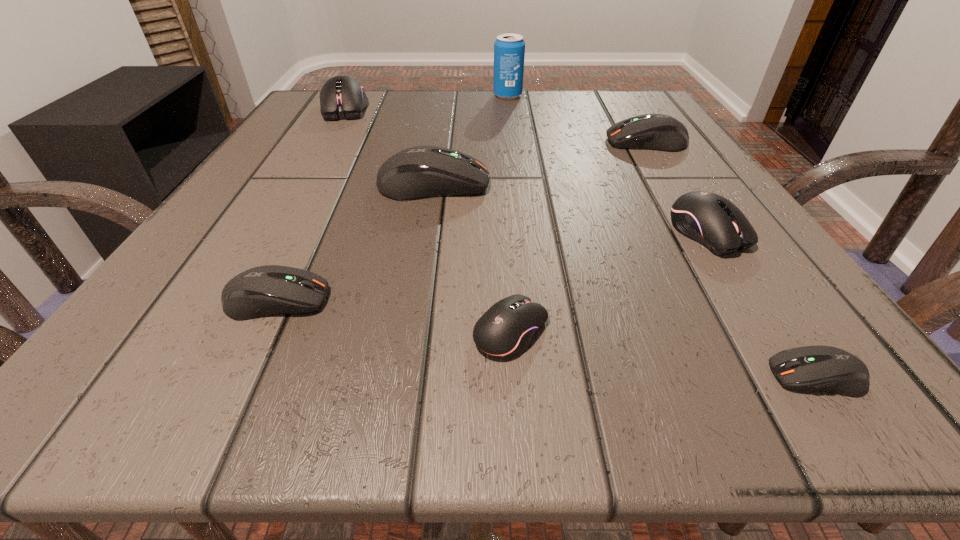
Find the location of a particular element. the tallest object is located at coordinates (509, 49).

The height and width of the screenshot is (540, 960). Identify the location of blue soda can. (509, 49).

Find the location of a particular element. the farthest black computer mouse is located at coordinates (341, 97).

This screenshot has height=540, width=960. In order to click on the biggest black computer mouse in this screenshot , I will do `click(341, 97)`.

Where is `the third dark computer equipment from right to left`? This screenshot has width=960, height=540. the third dark computer equipment from right to left is located at coordinates (420, 172).

At what (x,y) coordinates should I click in order to perform the action: click on the third farthest computer equipment. Please return your answer as a coordinate pair (x, y). Image resolution: width=960 pixels, height=540 pixels. Looking at the image, I should click on (420, 172).

Where is `the second biggest dark computer equipment`? the second biggest dark computer equipment is located at coordinates (659, 132).

Where is `the sixth nearest object`? The image size is (960, 540). the sixth nearest object is located at coordinates (659, 132).

You are a GUI agent. You are given a task and a screenshot of the screen. Output one action in this format:
    pyautogui.click(x=<x>, y=<y>)
    Task: Click on the fourth nearest computer equipment
    
    Given the screenshot: What is the action you would take?
    pyautogui.click(x=714, y=221)

You are a GUI agent. You are given a task and a screenshot of the screen. Output one action in this format:
    pyautogui.click(x=<x>, y=<y>)
    Task: Click on the rightmost black computer mouse
    The image size is (960, 540).
    Given the screenshot: What is the action you would take?
    pyautogui.click(x=714, y=221)